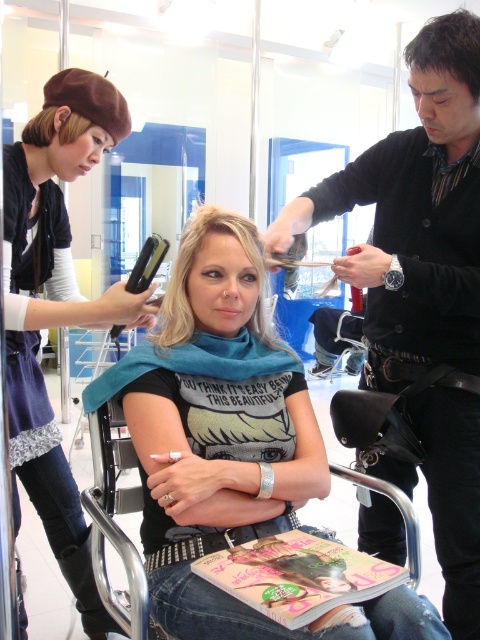
Locate an element on the screen. matte black shirt at center is located at coordinates (231, 448).

How much distance is there between matte black shirt at center and black leather belt at upper right?

The distance of matte black shirt at center from black leather belt at upper right is 15.63 inches.

Where is `matte black shirt at center`? The width and height of the screenshot is (480, 640). matte black shirt at center is located at coordinates (231, 448).

Locate an element on the screen. matte black shirt at center is located at coordinates (231, 448).

Is blonde hair at center taller than dark brown hair at upper right?

Yes.

From the picture: Can you confirm if blonde hair at center is positioned above dark brown hair at upper right?

Incorrect, blonde hair at center is not positioned above dark brown hair at upper right.

Identify the location of blonde hair at center. The image size is (480, 640). (190, 269).

Between brown beret at upper left and matte brown hair at upper left, which one has more height?

brown beret at upper left

Can you confirm if brown beret at upper left is taller than matte brown hair at upper left?

Yes, brown beret at upper left is taller than matte brown hair at upper left.

Locate an element on the screen. brown beret at upper left is located at coordinates coord(56,316).

Where is `brown beret at upper left`? brown beret at upper left is located at coordinates (56, 316).